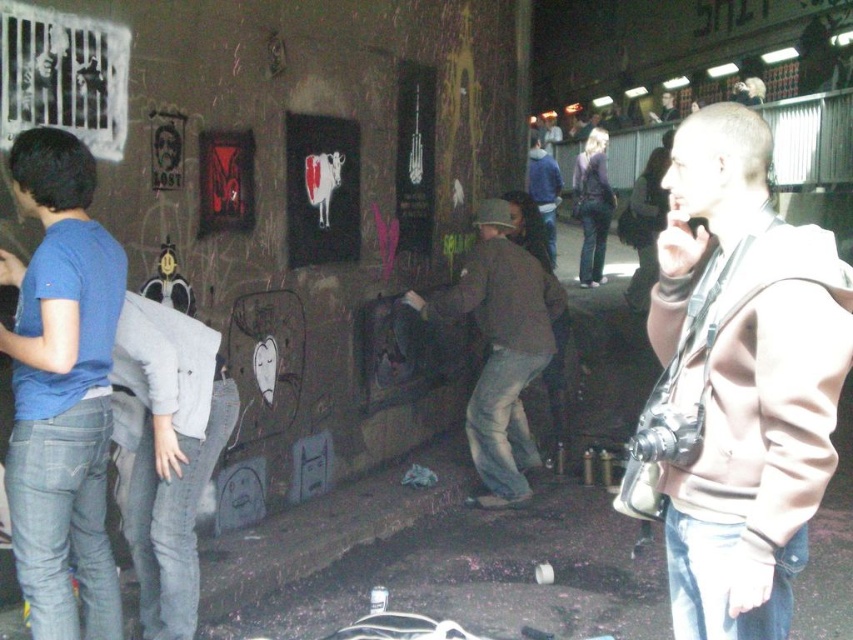
You are a photographer trying to capture both the light brown hoodie at right and the blue fleece jacket at center in a single frame. Given their sizes, which clothing item will appear larger in your photo?

The light brown hoodie at right will appear larger in the photo because its width is greater than that of the blue fleece jacket at center.